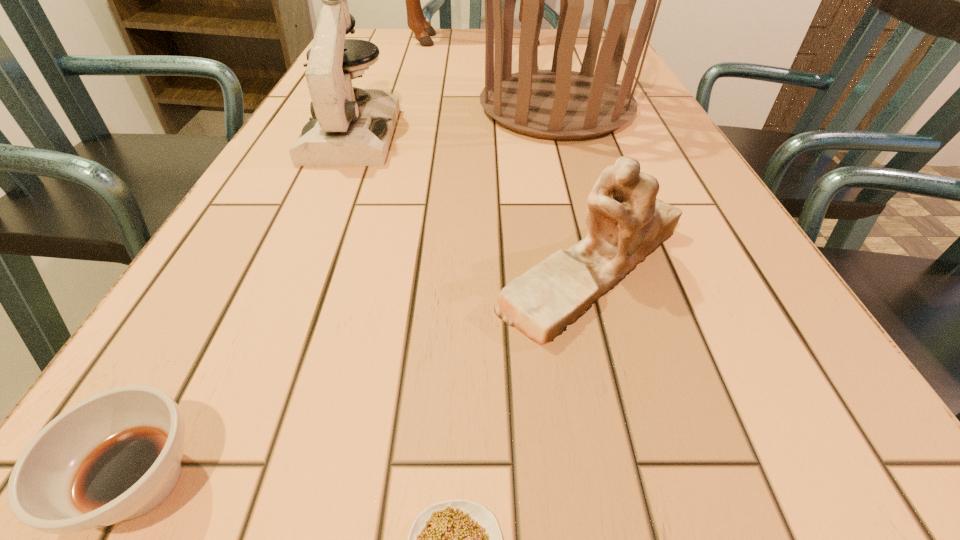
The image size is (960, 540). I want to click on free space between the fourth shortest object and the saddle, so click(x=429, y=87).

Where is `free space between the fourth farthest object and the farthest object`? The height and width of the screenshot is (540, 960). free space between the fourth farthest object and the farthest object is located at coordinates (550, 154).

The width and height of the screenshot is (960, 540). I want to click on empty location between the fourth farthest object and the farthest object, so [x=550, y=154].

At what (x,y) coordinates should I click in order to perform the action: click on free spot between the birdcage and the microscope. Please return your answer as a coordinate pair (x, y). Looking at the image, I should click on (454, 120).

This screenshot has width=960, height=540. Find the location of `vacant area that lies between the microscope and the birdcage`. vacant area that lies between the microscope and the birdcage is located at coordinates (454, 120).

Where is `vacant point located between the third tallest object and the birdcage`? The height and width of the screenshot is (540, 960). vacant point located between the third tallest object and the birdcage is located at coordinates (454, 120).

Locate an element on the screen. The width and height of the screenshot is (960, 540). vacant space in between the fourth shortest object and the birdcage is located at coordinates (454, 120).

Locate an element on the screen. The width and height of the screenshot is (960, 540). object that stands as the fourth closest to the farthest object is located at coordinates (116, 455).

Identify which object is located as the second nearest to the third nearest object. Please provide its 2D coordinates. Your answer should be formatted as a tuple, i.e. [(x, y)], where the tuple contains the x and y coordinates of a point satisfying the conditions above.

[(559, 104)]